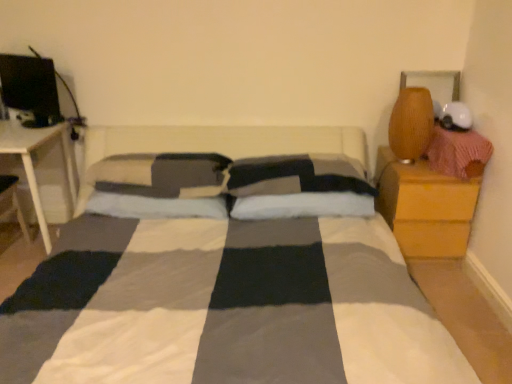
Question: Is white soft pillow at center, which ranks as the first pillow in right-to-left order, outside of matte brown vase at upper right?

Choices:
 (A) no
 (B) yes

Answer: (B)

Question: Can you confirm if white soft pillow at center, which is the 4th pillow in left-to-right order, is thinner than matte brown vase at upper right?

Choices:
 (A) no
 (B) yes

Answer: (A)

Question: Is matte brown vase at upper right at the back of white soft pillow at center, which is the 4th pillow in left-to-right order?

Choices:
 (A) yes
 (B) no

Answer: (B)

Question: From a real-world perspective, is white soft pillow at center, which ranks as the first pillow in right-to-left order, beneath matte brown vase at upper right?

Choices:
 (A) yes
 (B) no

Answer: (A)

Question: Is white soft pillow at center, which is the 4th pillow in left-to-right order, at the left side of matte brown vase at upper right?

Choices:
 (A) no
 (B) yes

Answer: (B)

Question: Is white soft pillow at center, which ranks as the first pillow in right-to-left order, facing towards matte brown vase at upper right?

Choices:
 (A) no
 (B) yes

Answer: (A)

Question: Is soft gray pillow at center, which is the 3th pillow in right-to-left order, far away from matte black monitor at upper left?

Choices:
 (A) yes
 (B) no

Answer: (B)

Question: Would you say soft gray pillow at center, which is counted as the second pillow, starting from the left, contains matte black monitor at upper left?

Choices:
 (A) no
 (B) yes

Answer: (A)

Question: Considering the relative positions of soft gray pillow at center, which is counted as the second pillow, starting from the left, and matte black monitor at upper left in the image provided, is soft gray pillow at center, which is counted as the second pillow, starting from the left, to the right of matte black monitor at upper left from the viewer's perspective?

Choices:
 (A) no
 (B) yes

Answer: (B)

Question: From the image's perspective, does soft gray pillow at center, which is counted as the second pillow, starting from the left, appear higher than matte black monitor at upper left?

Choices:
 (A) yes
 (B) no

Answer: (B)

Question: From a real-world perspective, is soft gray pillow at center, which is the 3th pillow in right-to-left order, below matte black monitor at upper left?

Choices:
 (A) yes
 (B) no

Answer: (A)

Question: Does soft gray pillow at center, which is counted as the second pillow, starting from the left, touch matte black monitor at upper left?

Choices:
 (A) yes
 (B) no

Answer: (B)

Question: Does matte black monitor at upper left appear on the left side of white soft pillow at center, which ranks as the first pillow in right-to-left order?

Choices:
 (A) yes
 (B) no

Answer: (A)